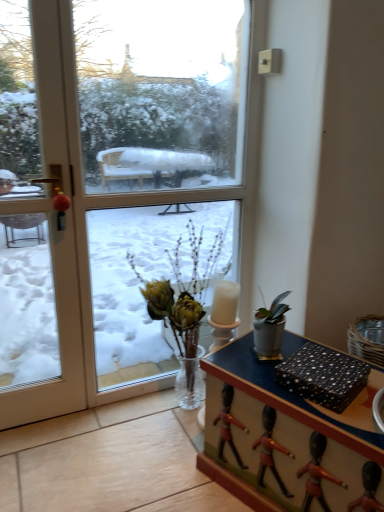
Question: From a real-world perspective, is black dotted paper at lower right positioned under transparent glass window at center based on gravity?

Choices:
 (A) no
 (B) yes

Answer: (B)

Question: Is black dotted paper at lower right in front of transparent glass window at center?

Choices:
 (A) yes
 (B) no

Answer: (A)

Question: Is black dotted paper at lower right at the right side of transparent glass window at center?

Choices:
 (A) no
 (B) yes

Answer: (B)

Question: Is the position of black dotted paper at lower right more distant than that of transparent glass window at center?

Choices:
 (A) no
 (B) yes

Answer: (A)

Question: Is there a large distance between black dotted paper at lower right and transparent glass window at center?

Choices:
 (A) yes
 (B) no

Answer: (A)

Question: Considering the relative sizes of black dotted paper at lower right and transparent glass window at center in the image provided, is black dotted paper at lower right wider than transparent glass window at center?

Choices:
 (A) yes
 (B) no

Answer: (A)

Question: Is black dotted paper at lower right directly adjacent to white glossy door at left?

Choices:
 (A) yes
 (B) no

Answer: (B)

Question: Is black dotted paper at lower right positioned before white glossy door at left?

Choices:
 (A) yes
 (B) no

Answer: (A)

Question: Considering the relative positions of black dotted paper at lower right and white glossy door at left in the image provided, is black dotted paper at lower right to the left of white glossy door at left from the viewer's perspective?

Choices:
 (A) no
 (B) yes

Answer: (A)

Question: Is black dotted paper at lower right bigger than white glossy door at left?

Choices:
 (A) no
 (B) yes

Answer: (A)

Question: Is black dotted paper at lower right facing away from white glossy door at left?

Choices:
 (A) yes
 (B) no

Answer: (B)

Question: Can you confirm if black dotted paper at lower right is taller than white glossy door at left?

Choices:
 (A) yes
 (B) no

Answer: (B)

Question: Is transparent glass window at center smaller than black dotted paper at lower right?

Choices:
 (A) no
 (B) yes

Answer: (A)